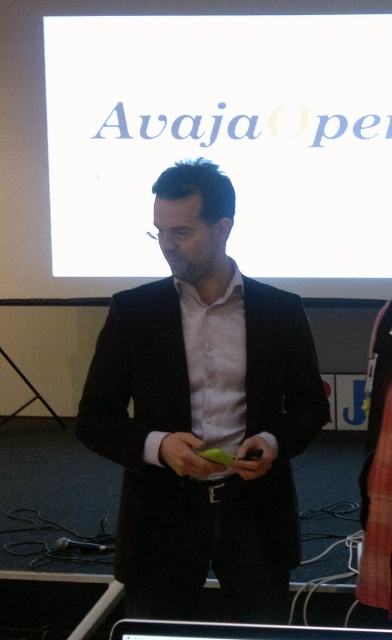
Question: Is white matte projection screen at upper center to the left of black matte suit at center from the viewer's perspective?

Choices:
 (A) no
 (B) yes

Answer: (A)

Question: Does white matte projection screen at upper center come behind black matte suit at center?

Choices:
 (A) no
 (B) yes

Answer: (B)

Question: Can you confirm if white matte projection screen at upper center is bigger than black matte suit at center?

Choices:
 (A) yes
 (B) no

Answer: (A)

Question: Which point is closer to the camera?

Choices:
 (A) (186, 83)
 (B) (241, 596)

Answer: (B)

Question: Which point is closer to the camera?

Choices:
 (A) (312, 422)
 (B) (310, 173)

Answer: (A)

Question: Which point appears closest to the camera in this image?

Choices:
 (A) (98, 125)
 (B) (235, 572)

Answer: (B)